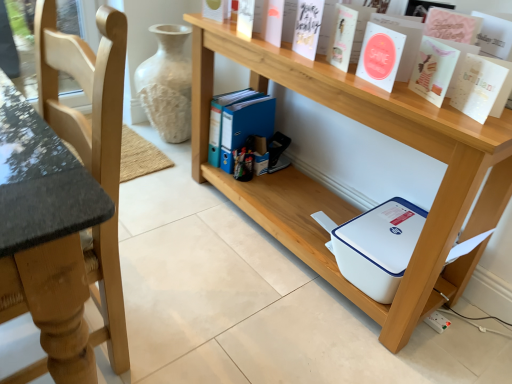
Question: Does white plastic printer at lower center appear on the right side of light wood chair at left?

Choices:
 (A) no
 (B) yes

Answer: (B)

Question: Is white plastic printer at lower center oriented away from light wood chair at left?

Choices:
 (A) yes
 (B) no

Answer: (B)

Question: Are white plastic printer at lower center and light wood chair at left far apart?

Choices:
 (A) yes
 (B) no

Answer: (B)

Question: Is light wood chair at left inside white plastic printer at lower center?

Choices:
 (A) yes
 (B) no

Answer: (B)

Question: From the image's perspective, does white plastic printer at lower center appear lower than light wood chair at left?

Choices:
 (A) no
 (B) yes

Answer: (A)

Question: Is white plastic printer at lower center in front of or behind matte pink card at upper right, which is counted as the 4th paperback book, starting from the left, in the image?

Choices:
 (A) behind
 (B) front

Answer: (B)

Question: From the image's perspective, is white plastic printer at lower center above or below matte pink card at upper right, arranged as the 2th paperback book when viewed from the right?

Choices:
 (A) below
 (B) above

Answer: (A)

Question: Is white plastic printer at lower center wider or thinner than matte pink card at upper right, which is counted as the 4th paperback book, starting from the left?

Choices:
 (A) wide
 (B) thin

Answer: (A)

Question: Is white plastic printer at lower center to the left or to the right of matte pink card at upper right, arranged as the 2th paperback book when viewed from the right, in the image?

Choices:
 (A) right
 (B) left

Answer: (B)

Question: Looking at the image, does white matte paper at upper center, which ranks as the second paperback book in left-to-right order, seem bigger or smaller compared to white plastic printer at lower center?

Choices:
 (A) small
 (B) big

Answer: (A)

Question: From the image's perspective, is white matte paper at upper center, which ranks as the second paperback book in left-to-right order, above or below white plastic printer at lower center?

Choices:
 (A) below
 (B) above

Answer: (B)

Question: Is white matte paper at upper center, the fourth paperback book viewed from the right, wider or thinner than white plastic printer at lower center?

Choices:
 (A) wide
 (B) thin

Answer: (B)

Question: Is white matte paper at upper center, the fourth paperback book viewed from the right, spatially inside white plastic printer at lower center, or outside of it?

Choices:
 (A) inside
 (B) outside

Answer: (B)

Question: Looking at the image, does white paper at upper right, which ranks as the first paperback book in right-to-left order, seem bigger or smaller compared to light wood chair at left?

Choices:
 (A) small
 (B) big

Answer: (A)

Question: From their relative heights in the image, would you say white paper at upper right, acting as the fifth paperback book starting from the left, is taller or shorter than light wood chair at left?

Choices:
 (A) tall
 (B) short

Answer: (B)